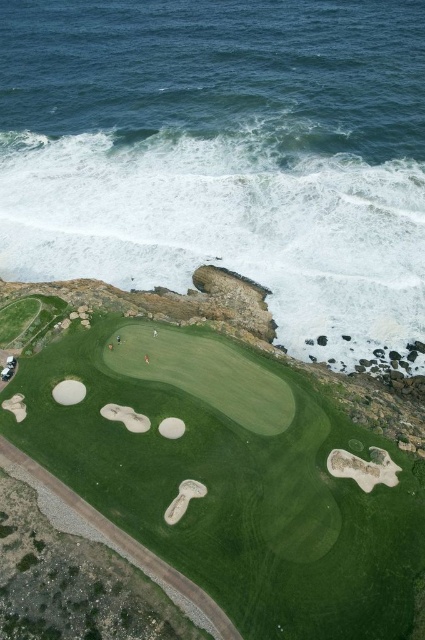
You are a golfer standing on the green grassy golf course at center. You want to hit the ball towards the white foamy wave at upper center. Which direction should you aim?

You should aim to the right because the green grassy golf course at center is to the left of the white foamy wave at upper center, so hitting towards the right will direct the ball toward the white foamy wave at upper center.

In the scene shown: You are a golfer standing on the green grassy golf course at center and want to hit the ball to the white sand bunker at lower left. Considering the size difference between them, which area will require more precision to aim for?

The white sand bunker at lower left requires more precision to aim for since it has a smaller size compared to the green grassy golf course at center.

You are a golfer standing on the cliff edge overlooking the golf course. You see the white foamy wave at upper center and the white sand bunker at lower left. Which of these two white objects is larger in size?

The white foamy wave at upper center is bigger than the white sand bunker at lower left.